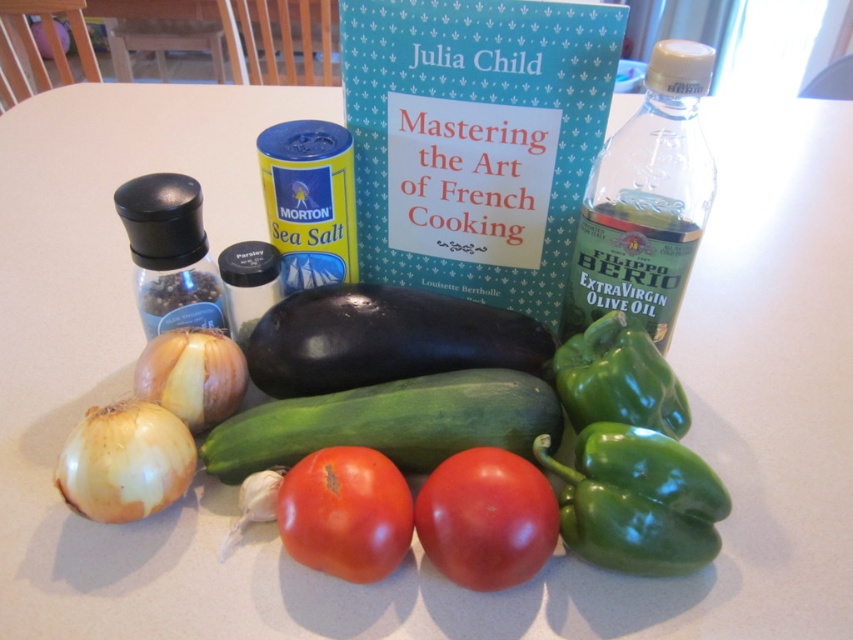
Describe the element at coordinates (637, 500) in the screenshot. I see `green matte bell pepper at lower right` at that location.

Does point (720, 506) come in front of point (337, 477)?

No.

Which is behind, point (566, 532) or point (302, 483)?

The point (566, 532) is behind.

The height and width of the screenshot is (640, 853). What are the coordinates of `green matte bell pepper at lower right` in the screenshot? It's located at (637, 500).

Consider the image. Does red matte tomato at center appear on the right side of white matte garlic at center?

Yes, red matte tomato at center is to the right of white matte garlic at center.

Between red matte tomato at center and white matte garlic at center, which one has more height?

Standing taller between the two is red matte tomato at center.

Is point (502, 561) positioned in front of point (247, 516)?

Yes, point (502, 561) is in front of point (247, 516).

This screenshot has height=640, width=853. In order to click on red matte tomato at center in this screenshot , I will do (486, 518).

Can you confirm if green smooth cucumber at center is positioned below green matte bell pepper at lower right?

Actually, green smooth cucumber at center is above green matte bell pepper at lower right.

Is point (531, 442) closer to viewer compared to point (596, 509)?

That is False.

Describe the element at coordinates (390, 422) in the screenshot. The width and height of the screenshot is (853, 640). I see `green smooth cucumber at center` at that location.

What are the coordinates of `green smooth cucumber at center` in the screenshot? It's located at (390, 422).